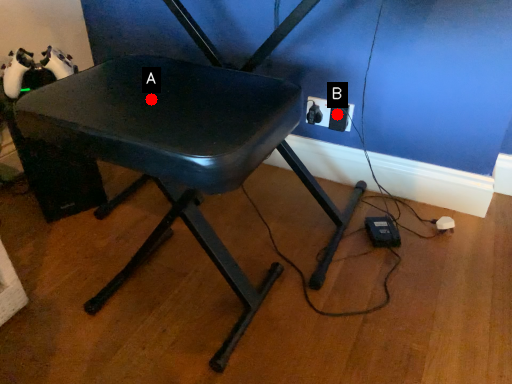
Question: Two points are circled on the image, labeled by A and B beside each circle. Among these points, which one is nearest to the camera?

Choices:
 (A) A is closer
 (B) B is closer

Answer: (A)